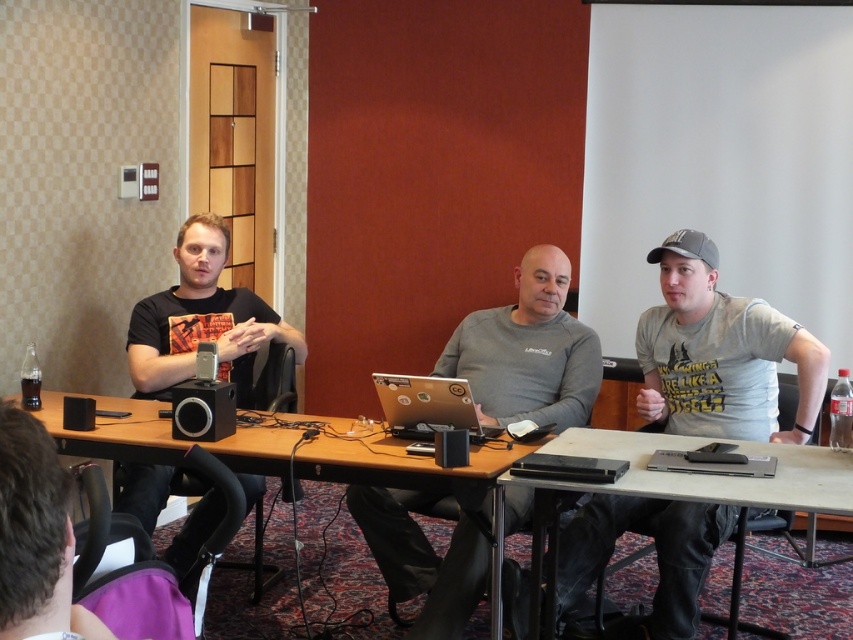
You are sitting at the long wooden table and want to pass a document to the person on your right. There are two laptops in the way, the silver metallic laptop at center and the black plastic laptop at center. Which laptop should you move to the left to create space?

The silver metallic laptop at center is already to the left of the black plastic laptop at center, so moving it further left might not be necessary. Instead, moving the black plastic laptop at center to the right could create more space. However, since the question specifies moving the laptop to the left, the silver metallic laptop at center is already positioned to the left of the black plastic laptop at center, so moving it further left may not obstruct the path. Alternatively, moving the black plastic to

You are sitting at the long wooden table in the scene and want to access your laptop. Which laptop, the silver metallic laptop at center or the black plastic laptop at center, is closer to you?

The silver metallic laptop at center is closer to you because the black plastic laptop at center is behind it.